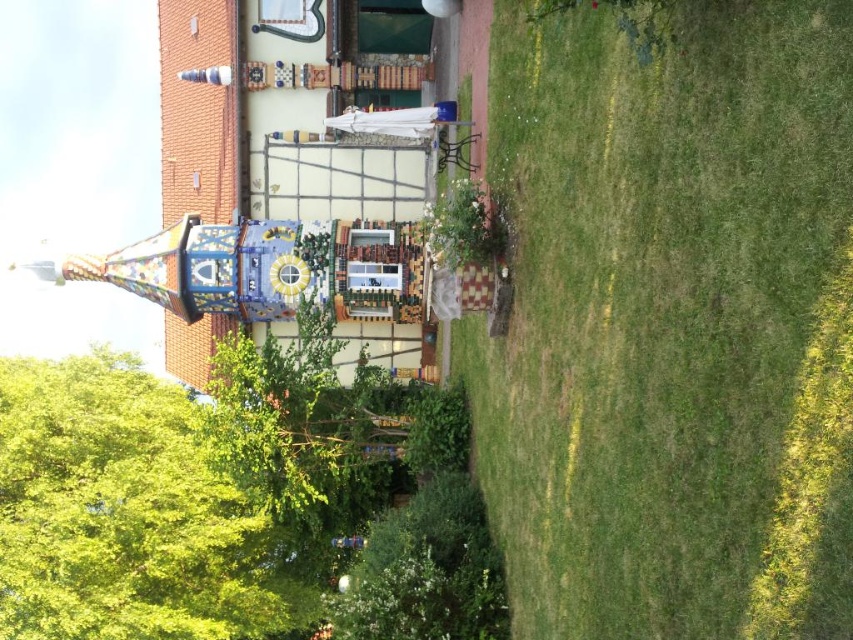
You are standing in front of the clock tower and want to take a photo that includes both the green grass at lower right and the green leafy tree at left. Which object will appear smaller in the photo?

The green grass at lower right will appear smaller in the photo because it is physically smaller than the green leafy tree at left.

You are standing in front of the clock tower and want to walk towards the green leafy tree at left. Which direction should you move relative to the green grass at lower right?

The green grass at lower right has a lesser width compared to green leafy tree at left, so you should move towards the left side of the green grass at lower right to reach the green leafy tree at left.

You are standing in front of the clock tower and want to take a photo that includes both the green grass at lower right and the green leafy tree at left. Which object will appear larger in the photo?

The green grass at lower right will appear larger in the photo because it is taller than the green leafy tree at left.